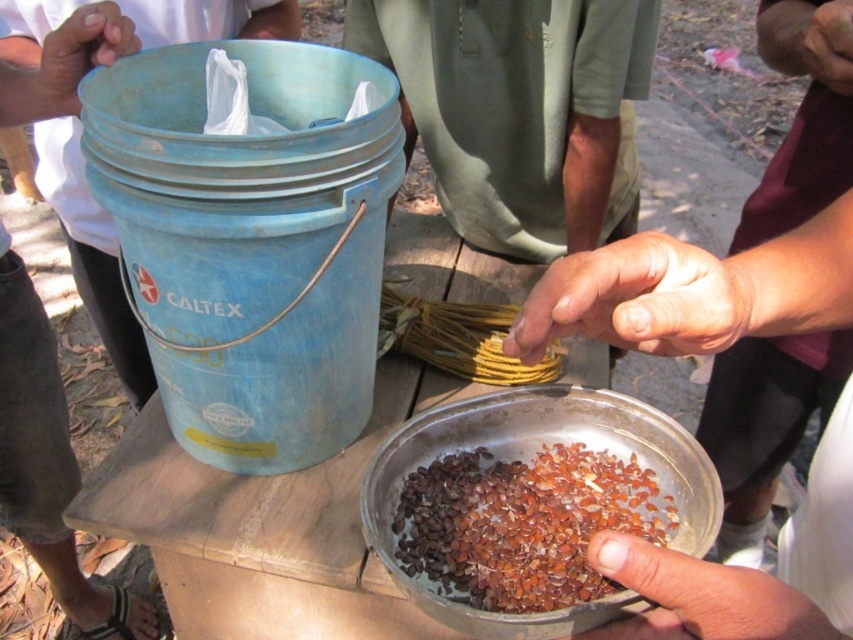
You are a worker sorting seeds on the table. You need to move the brown matte finger at lower center and the smooth skin hand at upper left closer to each other. Which one should you move towards the other to make them closer?

The brown matte finger at lower center is closer to the viewer than the smooth skin hand at upper left, so you should move the smooth skin hand at upper left toward the brown matte finger at lower center to make them closer.

You are a quality inspector checking the sorting process. You need to ensure that the brown glossy seeds at center are within a 10 inch safety distance from the brown matte finger at lower center to prevent contamination. Is the current distance compliant with the safety requirement?

The brown glossy seeds at center is 8.51 inches from the brown matte finger at lower center, which is within the 10 inch safety distance requirement. Therefore, the current distance complies with the safety requirement.

You are a quality inspector checking the sorting process. You notice the dry skin at center and the smooth skin hand at upper left. Which object is closer to you?

The smooth skin hand at upper left is closer to you because it is positioned above the dry skin at center.